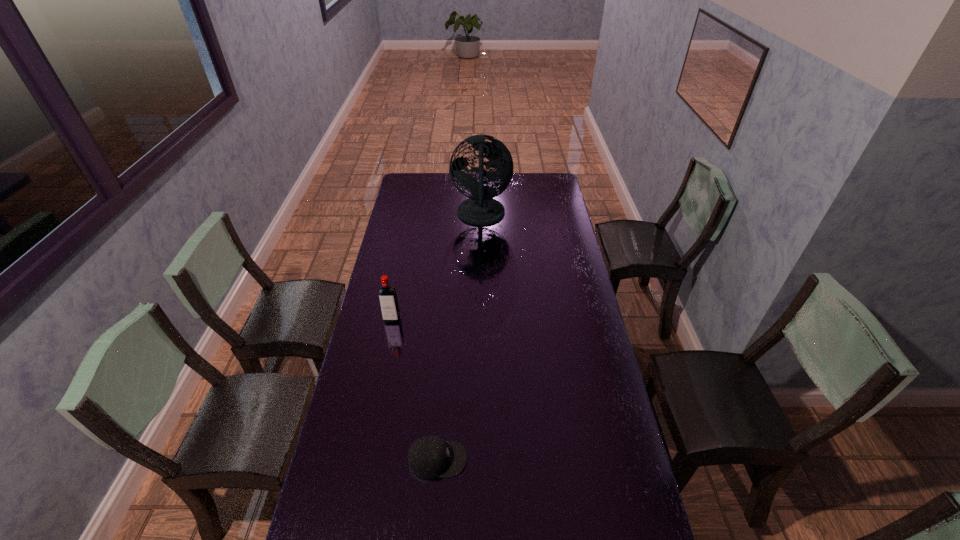
Locate an element on the screen. The width and height of the screenshot is (960, 540). free space located 0.070m on the front-facing side of the shortest object is located at coordinates (491, 460).

Locate an element on the screen. Image resolution: width=960 pixels, height=540 pixels. object situated at the left edge is located at coordinates (388, 300).

Where is `blank space at the far edge`? This screenshot has height=540, width=960. blank space at the far edge is located at coordinates (433, 177).

Find the location of a particular element. The width and height of the screenshot is (960, 540). vacant space at the left edge is located at coordinates (360, 376).

In the image, there is a desktop. Where is `free space at the right edge`? The image size is (960, 540). free space at the right edge is located at coordinates (623, 537).

Where is `vacant point at the far left corner`? The height and width of the screenshot is (540, 960). vacant point at the far left corner is located at coordinates (406, 174).

Identify the location of free location at the far right corner. This screenshot has width=960, height=540. (540, 186).

At what (x,y) coordinates should I click in order to perform the action: click on vacant space that's between the nearest object and the globe. Please return your answer as a coordinate pair (x, y). This screenshot has width=960, height=540. Looking at the image, I should click on (459, 337).

Identify the location of vacant region between the shortest object and the leftmost object. (415, 389).

Where is `vacant area that lies between the globe and the cap`? The height and width of the screenshot is (540, 960). vacant area that lies between the globe and the cap is located at coordinates (459, 337).